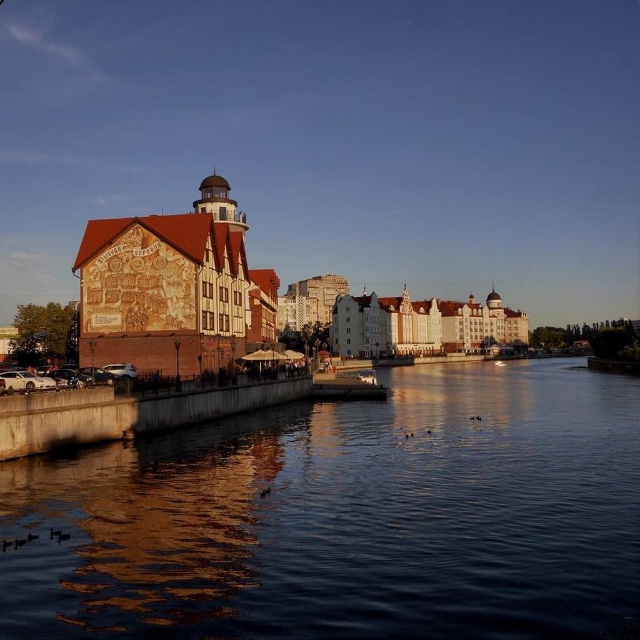
Question: Which of the following is the closest to the observer?

Choices:
 (A) click(536, 532)
 (B) click(504, 324)

Answer: (A)

Question: Which point is farther to the camera?

Choices:
 (A) dark water at center
 (B) brick building at left

Answer: (B)

Question: Does dark water at center appear under brick building at left?

Choices:
 (A) no
 (B) yes

Answer: (B)

Question: Does dark water at center appear on the left side of brick building at left?

Choices:
 (A) no
 (B) yes

Answer: (B)

Question: Is dark water at center smaller than brick building at left?

Choices:
 (A) yes
 (B) no

Answer: (A)